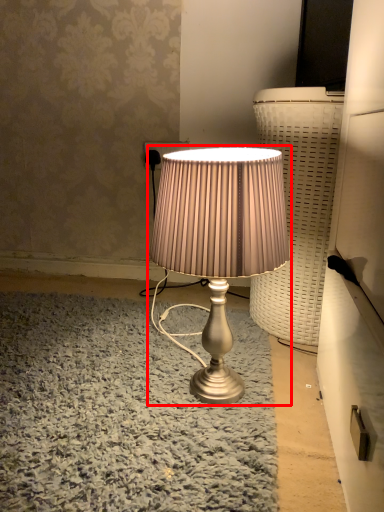
Question: In this image, where is lamp (annotated by the red box) located relative to electric outlet?

Choices:
 (A) left
 (B) right

Answer: (B)